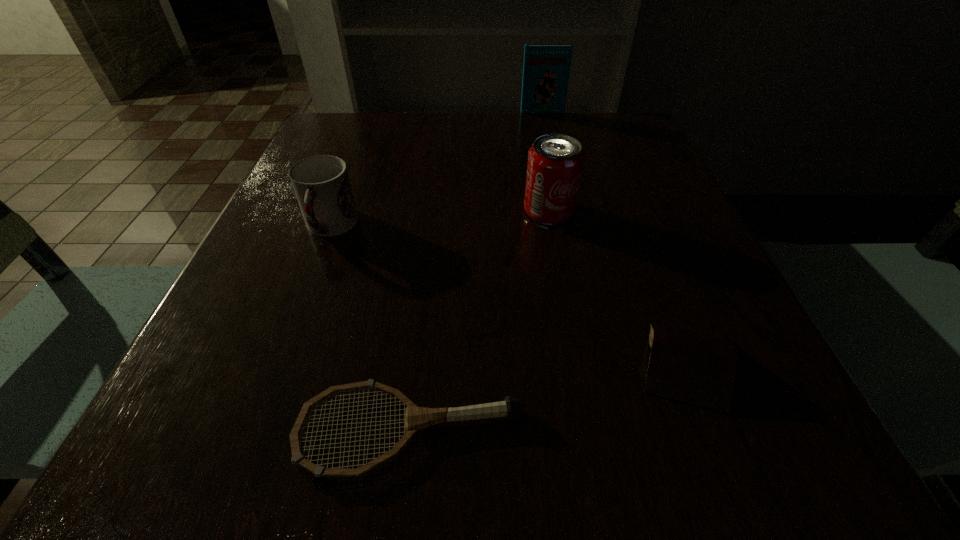
Image resolution: width=960 pixels, height=540 pixels. I want to click on vacant point at the far edge, so click(468, 153).

Find the location of a particular element. The height and width of the screenshot is (540, 960). vacant area at the near edge of the desktop is located at coordinates (609, 441).

Locate an element on the screen. This screenshot has height=540, width=960. free space at the left edge of the desktop is located at coordinates (312, 234).

Identify the location of free space at the right edge. (710, 294).

Locate an element on the screen. The height and width of the screenshot is (540, 960). free space at the far left corner is located at coordinates (380, 112).

What are the coordinates of `free spot at the near right corner of the desktop` in the screenshot? It's located at (734, 444).

At what (x,y) coordinates should I click in order to perform the action: click on vacant point located between the cup and the shortest object. Please return your answer as a coordinate pair (x, y). Looking at the image, I should click on (370, 329).

The width and height of the screenshot is (960, 540). What are the coordinates of `free space between the tallest object and the shortest object` in the screenshot? It's located at (475, 272).

Identify the location of blank region between the nearer book and the farthest object. (613, 237).

At what (x,y) coordinates should I click in order to perform the action: click on vacant area between the shorter book and the leftmost object. Please return your answer as a coordinate pair (x, y). Looking at the image, I should click on (507, 295).